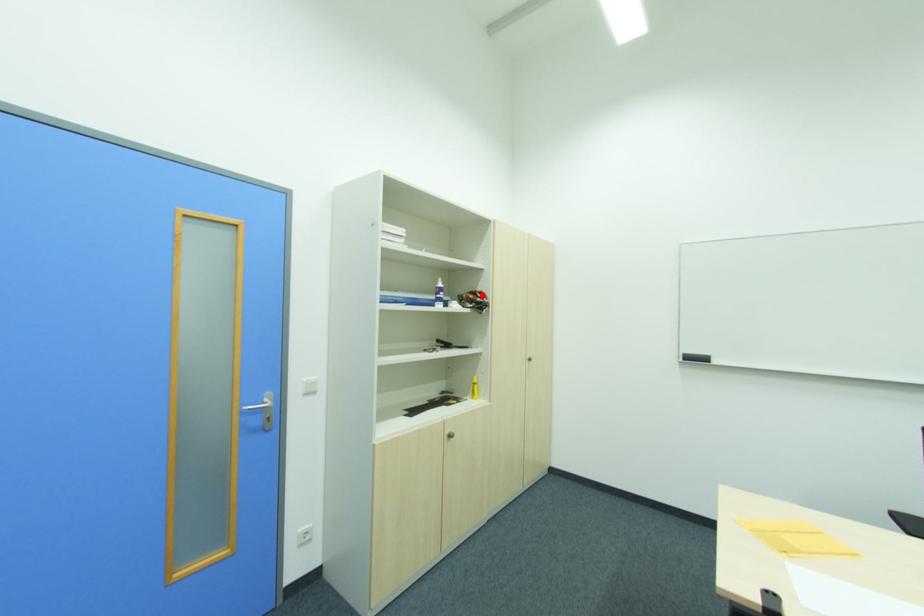
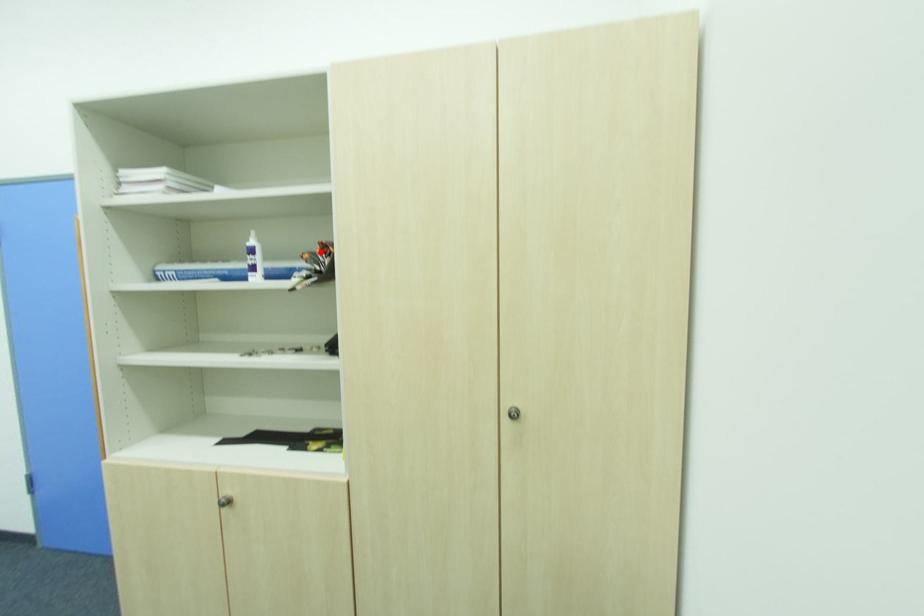
I am providing you with two images of the same scene from different viewpoints. A red point is marked on the first image and another point is marked on the second image. Does the point marked in image1 correspond to the same location as the one in image2?

Yes